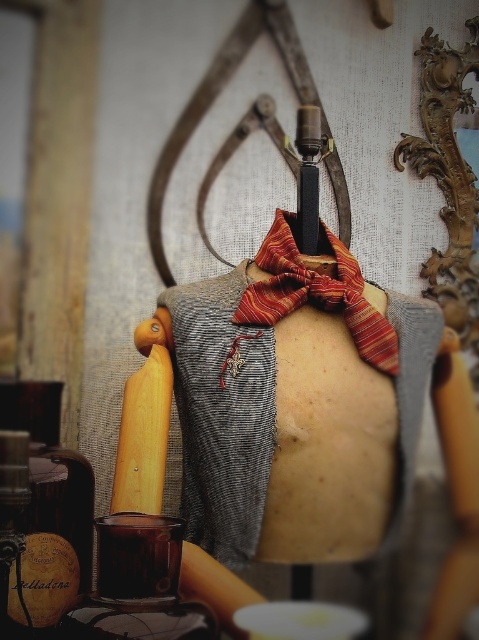
Question: Is striped silk bow at center positioned in front of wooden rolling pin at left?

Choices:
 (A) yes
 (B) no

Answer: (B)

Question: Is striped silk bow at center to the left of wooden rolling pin at left from the viewer's perspective?

Choices:
 (A) yes
 (B) no

Answer: (B)

Question: Is striped silk bow at center behind wooden rolling pin at left?

Choices:
 (A) yes
 (B) no

Answer: (A)

Question: Among these objects, which one is nearest to the camera?

Choices:
 (A) wooden rolling pin at left
 (B) striped silk bow at center

Answer: (A)

Question: Which of the following is the farthest from the observer?

Choices:
 (A) coord(266,236)
 (B) coord(143,438)

Answer: (A)